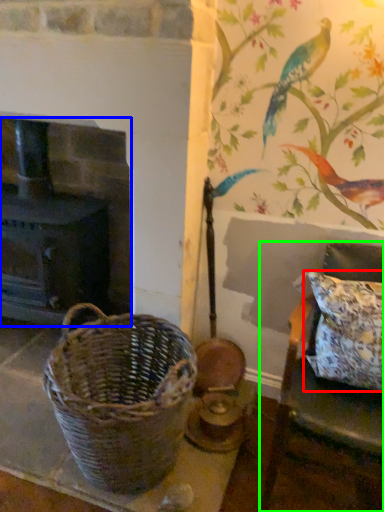
Question: Based on their relative distances, which object is farther from pillow (highlighted by a red box)? Choose from fireplace (highlighted by a blue box) and furniture (highlighted by a green box).

Choices:
 (A) fireplace
 (B) furniture

Answer: (A)